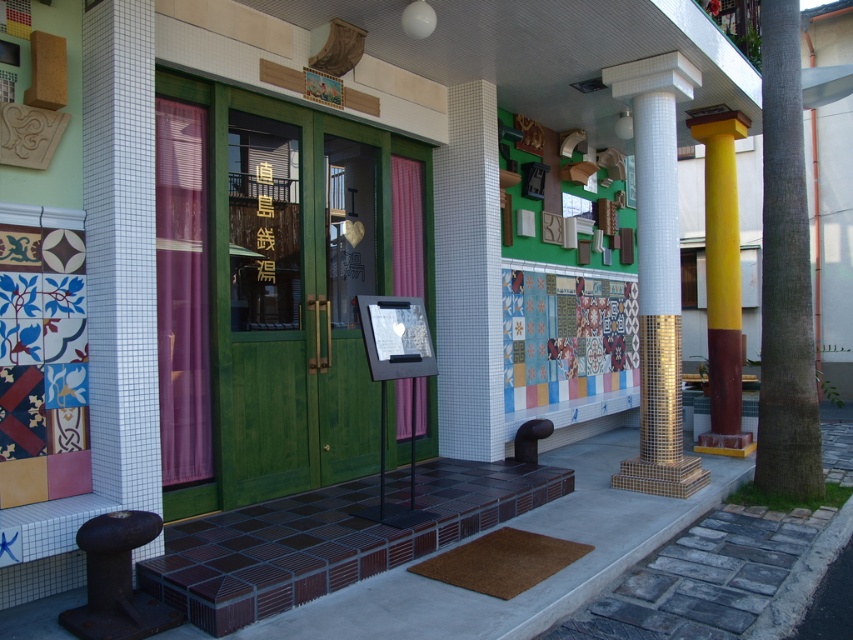
Is green wooden door at center below yellow mosaic column at right?

Indeed, green wooden door at center is positioned under yellow mosaic column at right.

Is green wooden door at center further to camera compared to yellow mosaic column at right?

No, green wooden door at center is closer to the viewer.

Where is `green wooden door at center`? This screenshot has height=640, width=853. green wooden door at center is located at coordinates (264, 314).

Where is `green wooden door at center`? The height and width of the screenshot is (640, 853). green wooden door at center is located at coordinates (264, 314).

Consider the image. Does green wooden door at center appear on the left side of white mosaic pillar at center?

Indeed, green wooden door at center is positioned on the left side of white mosaic pillar at center.

Is point (289, 262) closer to viewer compared to point (647, 298)?

Yes, it is.

Locate an element on the screen. This screenshot has height=640, width=853. green wooden door at center is located at coordinates (264, 314).

Who is shorter, brown brick pavement at lower center or brown textured pillar at right?

With less height is brown brick pavement at lower center.

Is brown brick pavement at lower center taller than brown textured pillar at right?

In fact, brown brick pavement at lower center may be shorter than brown textured pillar at right.

Is point (762, 598) farther from viewer compared to point (764, 337)?

No, it is in front of (764, 337).

Identify the location of brown brick pavement at lower center. This screenshot has height=640, width=853. (584, 564).